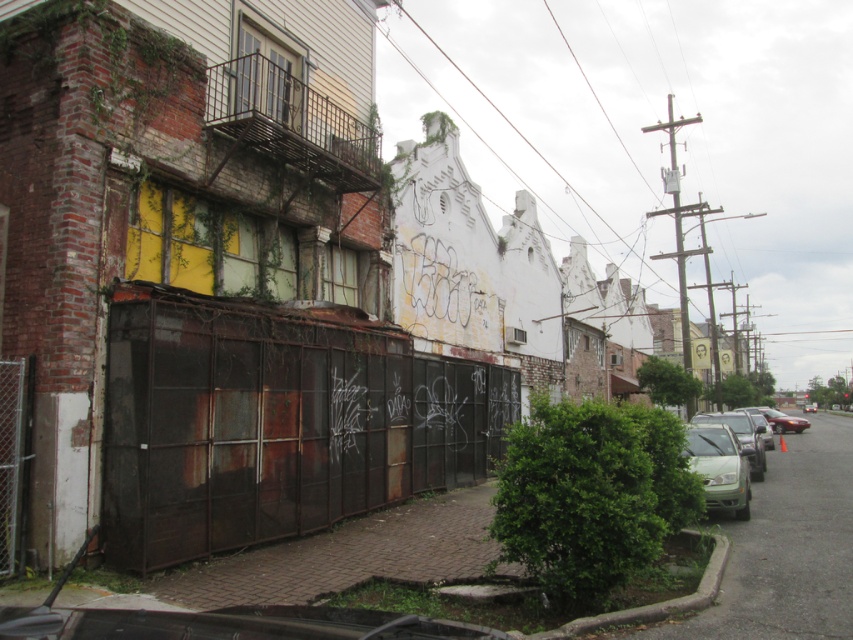
Between rusty metal fence at center and green matte car at lower right, which one has less height?

green matte car at lower right is shorter.

Is point (171, 451) farther from viewer compared to point (743, 460)?

No, it is in front of (743, 460).

Who is more distant from viewer, (x=259, y=429) or (x=693, y=456)?

Point (x=693, y=456)

You are a GUI agent. You are given a task and a screenshot of the screen. Output one action in this format:
    pyautogui.click(x=<x>, y=<y>)
    Task: Click on the rusty metal fence at center
    
    Given the screenshot: What is the action you would take?
    pyautogui.click(x=276, y=422)

Who is more distant from viewer, (x=186, y=385) or (x=706, y=502)?

Positioned behind is point (x=706, y=502).

Looking at this image, can you confirm if rusty metal fence at center is positioned below green matte sedan at right?

No, rusty metal fence at center is not below green matte sedan at right.

Does point (331, 317) come farther from viewer compared to point (740, 426)?

No, it is in front of (740, 426).

I want to click on rusty metal fence at center, so click(x=276, y=422).

What do you see at coordinates (276, 422) in the screenshot? I see `rusty metal fence at center` at bounding box center [276, 422].

Does rusty metal fence at center have a larger size compared to rusty chain-link fence at lower left?

Yes, rusty metal fence at center is bigger than rusty chain-link fence at lower left.

Consider the image. Who is more distant from viewer, [436,483] or [0,380]?

Point [436,483]

Identify the location of rusty metal fence at center. 276,422.